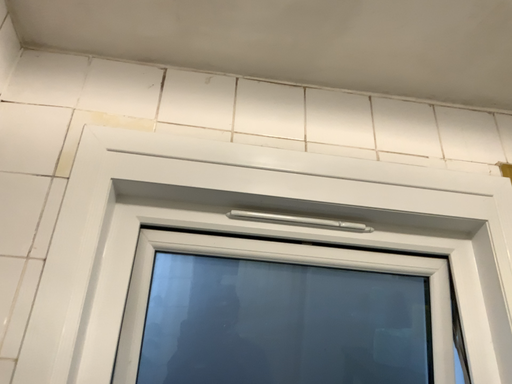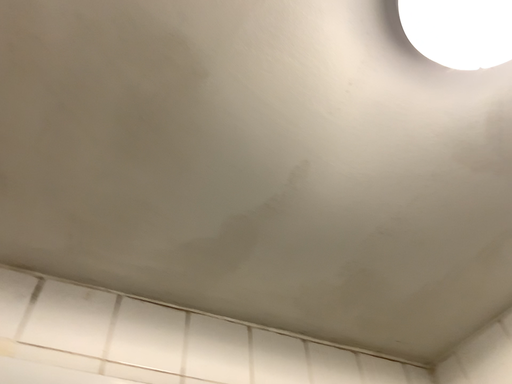
Question: How did the camera likely rotate when shooting the video?

Choices:
 (A) rotated right
 (B) rotated left

Answer: (A)